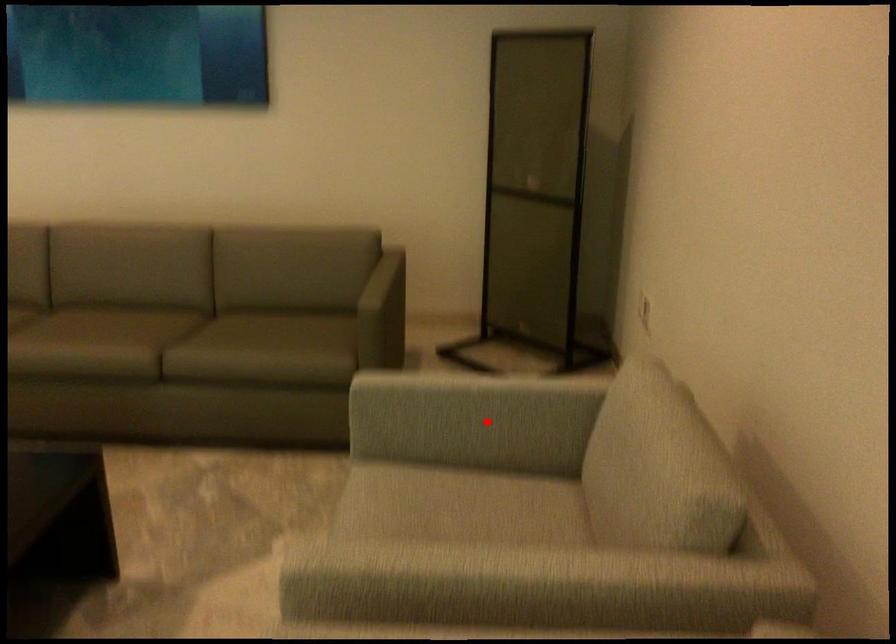
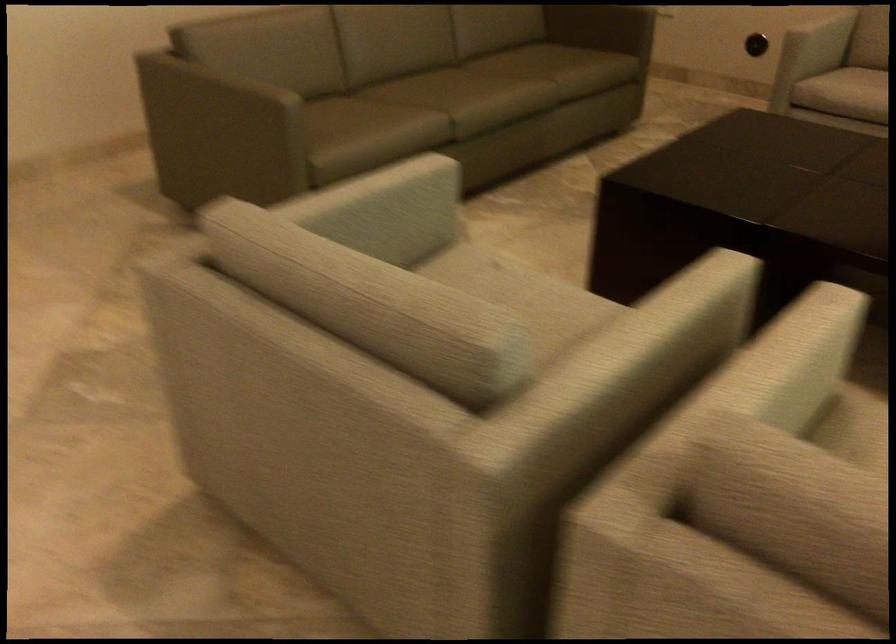
The point at the highlighted location is marked in the first image. Where is the corresponding point in the second image?

(821, 35)